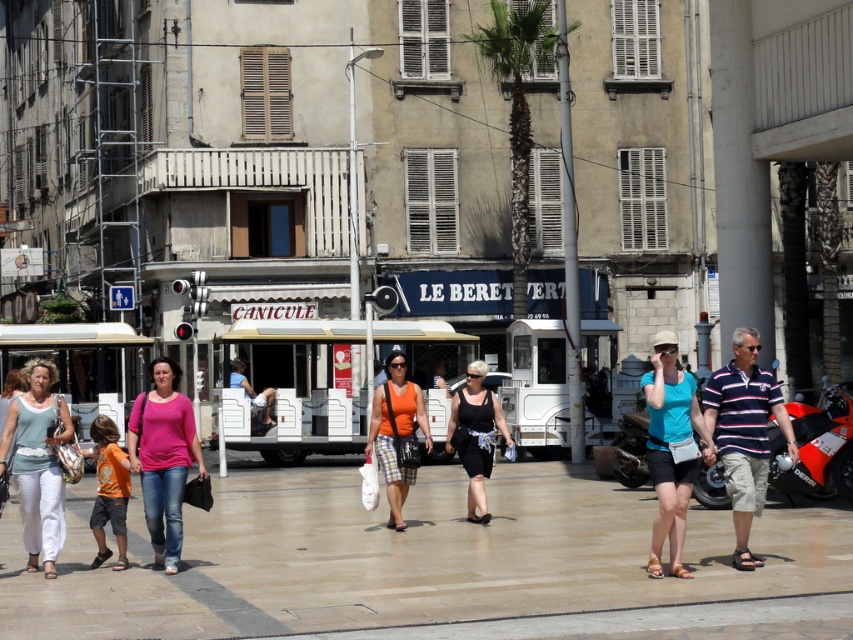
Which is behind, point (724, 404) or point (231, 368)?

The point (231, 368) is more distant.

Which is below, striped cotton polo shirt at center-right or orange shirt at center?

orange shirt at center is lower down.

This screenshot has height=640, width=853. What do you see at coordinates (744, 433) in the screenshot?
I see `striped cotton polo shirt at center-right` at bounding box center [744, 433].

Find the location of a particular element. striped cotton polo shirt at center-right is located at coordinates [x=744, y=433].

Is point (28, 486) positioned after point (666, 429)?

Yes, it is behind point (666, 429).

Locate an element on the screen. matte white pants at lower left is located at coordinates (38, 461).

Is point (18, 452) positioned after point (672, 508)?

Yes, point (18, 452) is behind point (672, 508).

Identify the location of matte white pants at lower left. The width and height of the screenshot is (853, 640). (38, 461).

Can you confirm if striped cotton polo shirt at center-right is positioned below matte white pants at lower left?

Incorrect, striped cotton polo shirt at center-right is not positioned below matte white pants at lower left.

The height and width of the screenshot is (640, 853). In order to click on striped cotton polo shirt at center-right in this screenshot , I will do `click(744, 433)`.